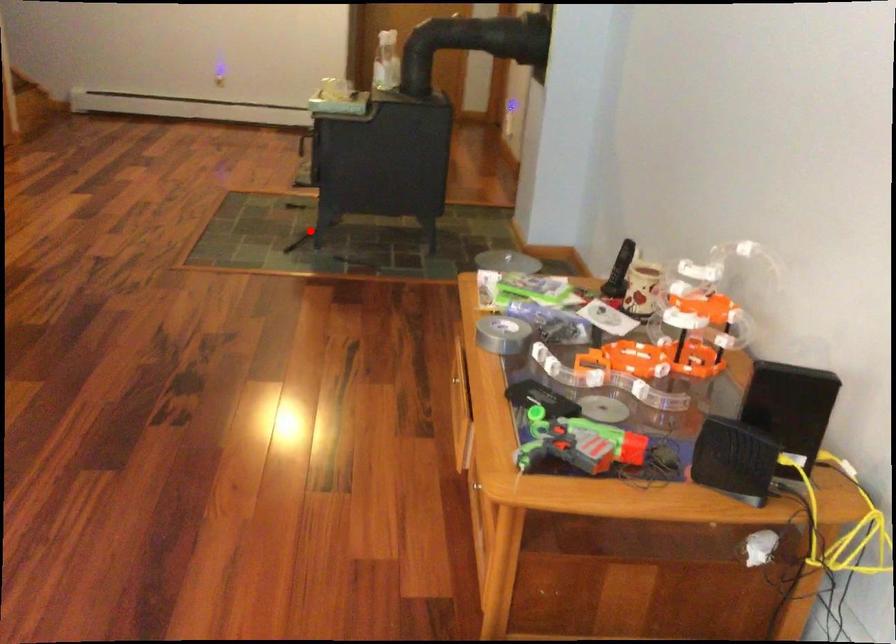
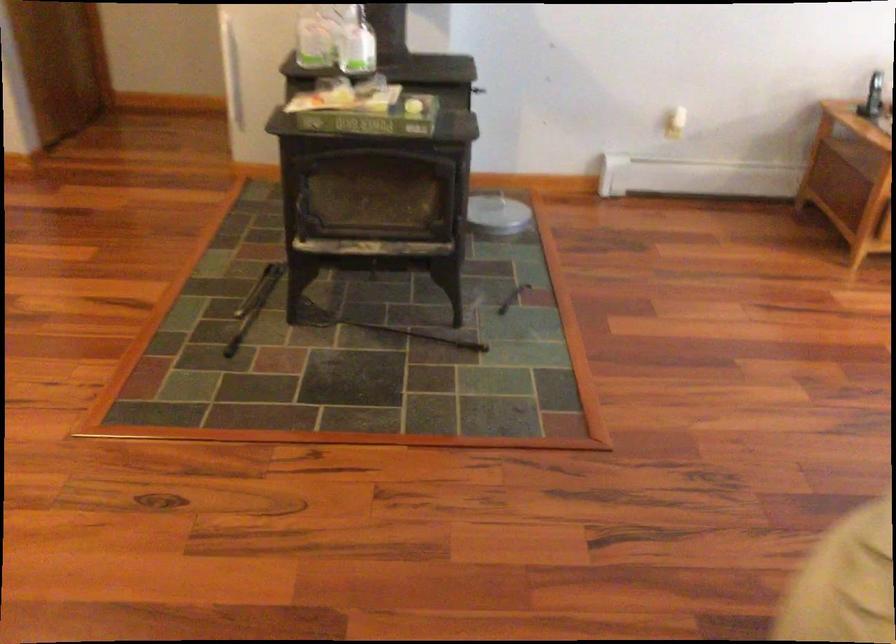
Question: I am providing you with two images of the same scene from different viewpoints. Image1 has a red point marked. In image2, the corresponding 3D location appears at what relative position? Reply with the corresponding letter.

Choices:
 (A) Closer
 (B) Farther

Answer: (A)